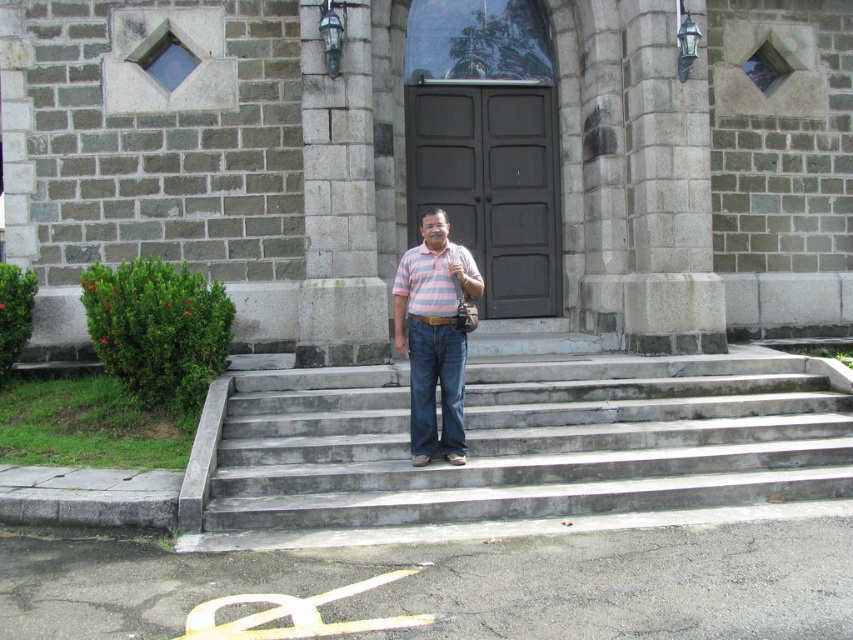
The image size is (853, 640). Find the location of `pink striped shirt at center`. pink striped shirt at center is located at coordinates (434, 336).

Who is more distant from viewer, (463,250) or (451,355)?

Positioned behind is point (463,250).

You are a GUI agent. You are given a task and a screenshot of the screen. Output one action in this format:
    pyautogui.click(x=<x>, y=<y>)
    Task: Click on the pink striped shirt at center
    This screenshot has width=853, height=640.
    Given the screenshot: What is the action you would take?
    pyautogui.click(x=434, y=336)

Between gray stone church at center and dark blue denim jeans at center, which one appears on the right side from the viewer's perspective?

Positioned to the right is gray stone church at center.

Between gray stone church at center and dark blue denim jeans at center, which one is positioned higher?

gray stone church at center

Is point (631, 330) positioned after point (415, 452)?

Yes, it is behind point (415, 452).

The height and width of the screenshot is (640, 853). I want to click on gray stone church at center, so [x=438, y=160].

Does gray stone church at center have a larger size compared to pink striped polo shirt at center?

Yes, gray stone church at center is bigger than pink striped polo shirt at center.

Can you confirm if gray stone church at center is shorter than pink striped polo shirt at center?

Incorrect, gray stone church at center's height does not fall short of pink striped polo shirt at center's.

Identify the location of gray stone church at center. This screenshot has width=853, height=640. (438, 160).